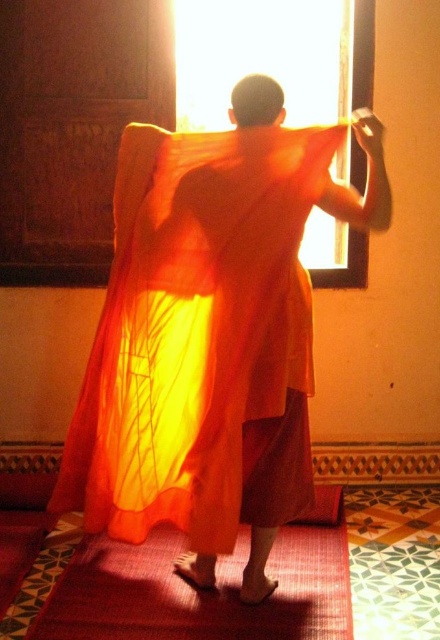
Question: Observing the image, what is the correct spatial positioning of translucent orange dress at center in reference to matte red carpet at lower center?

Choices:
 (A) right
 (B) left

Answer: (B)

Question: Among these objects, which one is nearest to the camera?

Choices:
 (A) translucent orange dress at center
 (B) matte red carpet at lower center

Answer: (B)

Question: Is translucent orange dress at center bigger than matte red carpet at lower center?

Choices:
 (A) yes
 (B) no

Answer: (A)

Question: Which of the following is the closest to the observer?

Choices:
 (A) (106, 544)
 (B) (95, 460)

Answer: (B)

Question: Does translucent orange dress at center appear under matte red carpet at lower center?

Choices:
 (A) yes
 (B) no

Answer: (B)